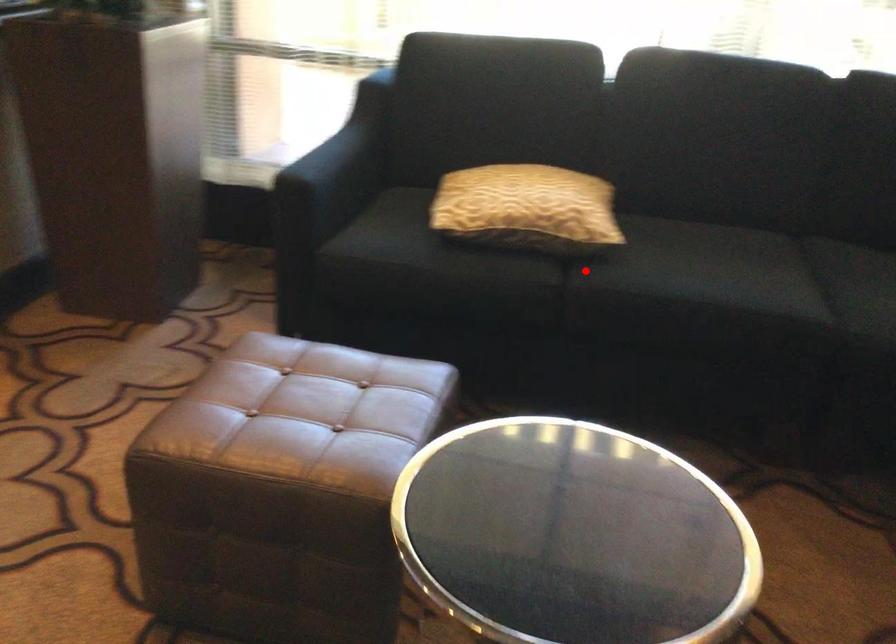
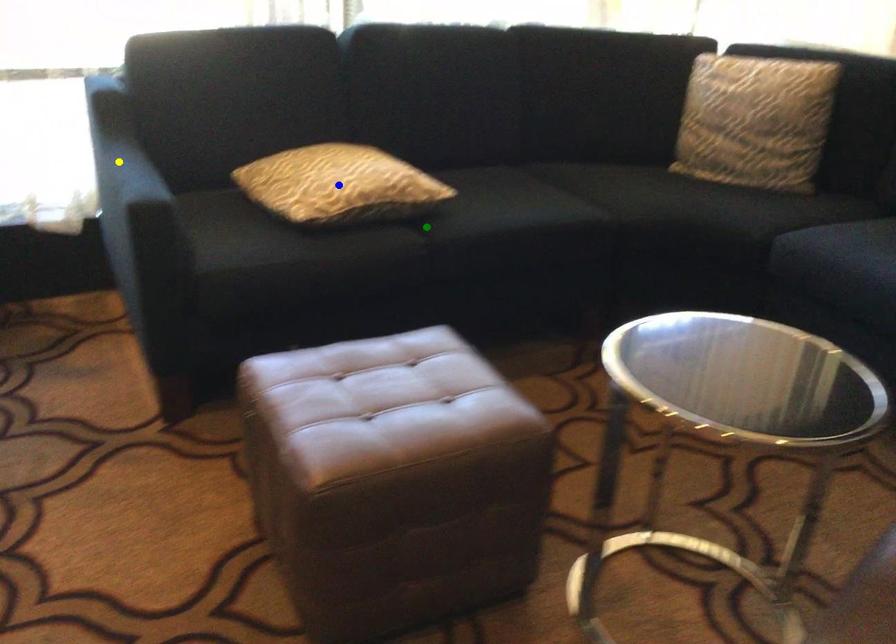
Question: I am providing you with two images of the same scene from different viewpoints. A red point is marked on the first image. You are given multiple points on the second image. Can you choose the point in image 2 that corresponds to the point in image 1?

Choices:
 (A) blue point
 (B) green point
 (C) yellow point

Answer: (B)